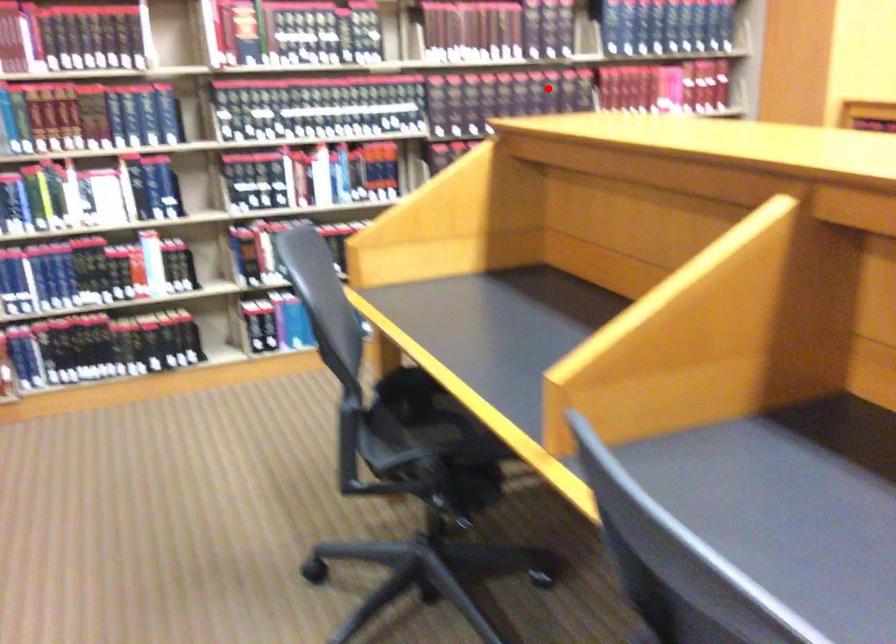
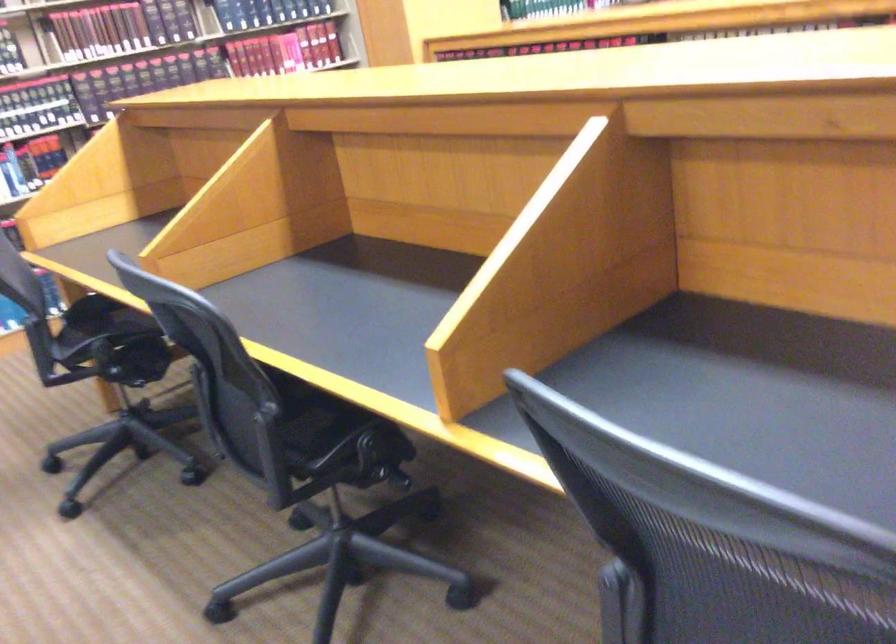
In the second image, find the point that corresponds to the highlighted location in the first image.

(177, 62)